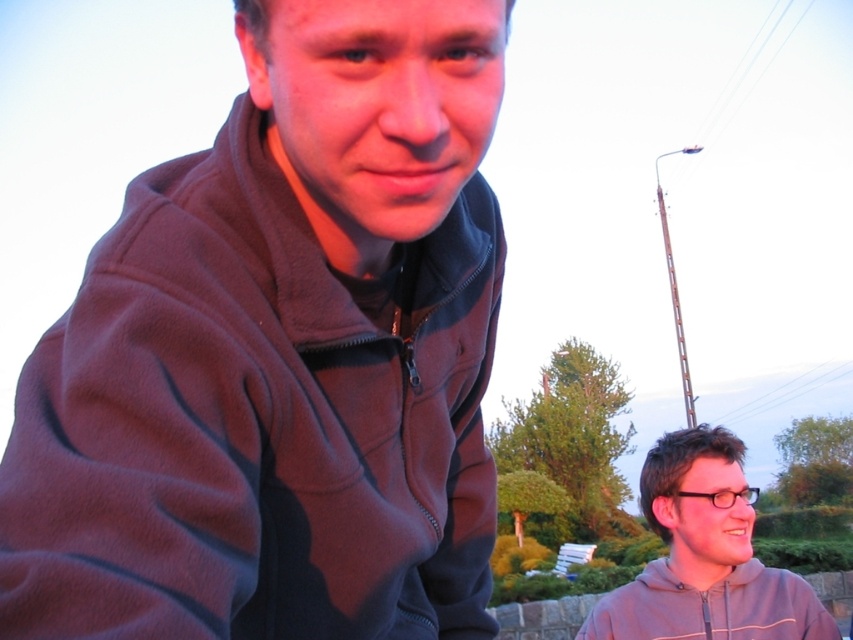
You are standing in the scene and want to move from point [685,605] to point [650,604]. Which direction should you move to get closer to the camera?

To move closer to the camera, you should move towards point [650,604] because it is farther from the camera compared to point [685,605].

You are a photographer trying to capture a photo of both the dark fleece jacket at upper left and the gray matte hoodie at lower right in the same frame. Based on their positions, which one would you need to adjust your camera angle upwards to include?

The dark fleece jacket at upper left is located above the gray matte hoodie at lower right, so you would need to adjust your camera angle upwards to include the dark fleece jacket at upper left.